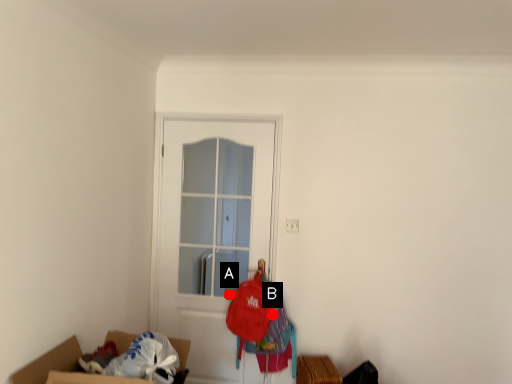
Question: Two points are circled on the image, labeled by A and B beside each circle. Which point is closer to the camera?

Choices:
 (A) A is closer
 (B) B is closer

Answer: (B)